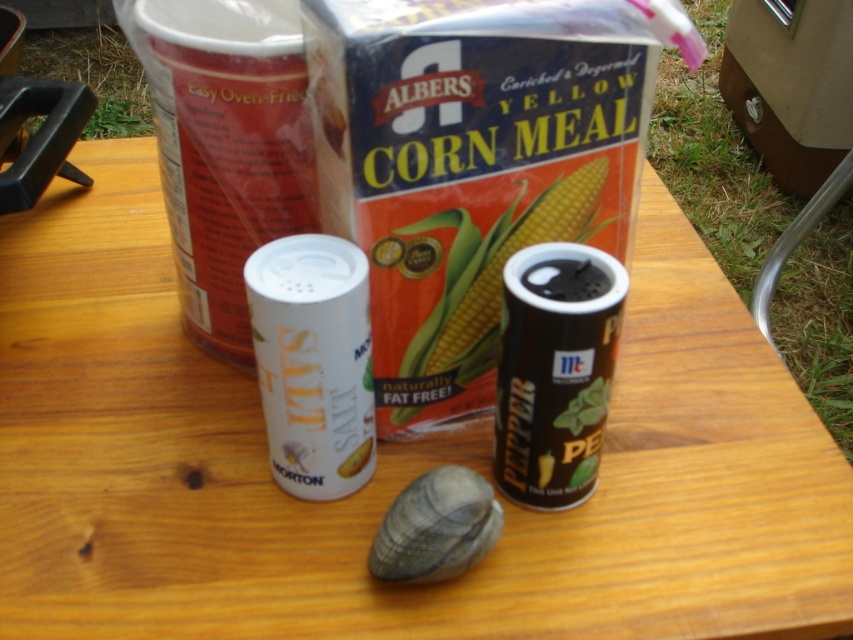
You are setting up a small table for a picnic and have placed both the black matte pepper shaker at center and the white matte salt shaker at center on the table. If you want to stack them to save space, which one should you place at the bottom?

The black matte pepper shaker at center is shorter than the white matte salt shaker at center, so you should place the taller white matte salt shaker at center at the bottom to provide a stable base for the shorter pepper shaker.

From the picture: You are standing at the wooden table outdoors and want to locate the point at coordinates (312, 362). Which object is this point located on?

The point at coordinates (312, 362) is located on the white matte salt shaker at center.